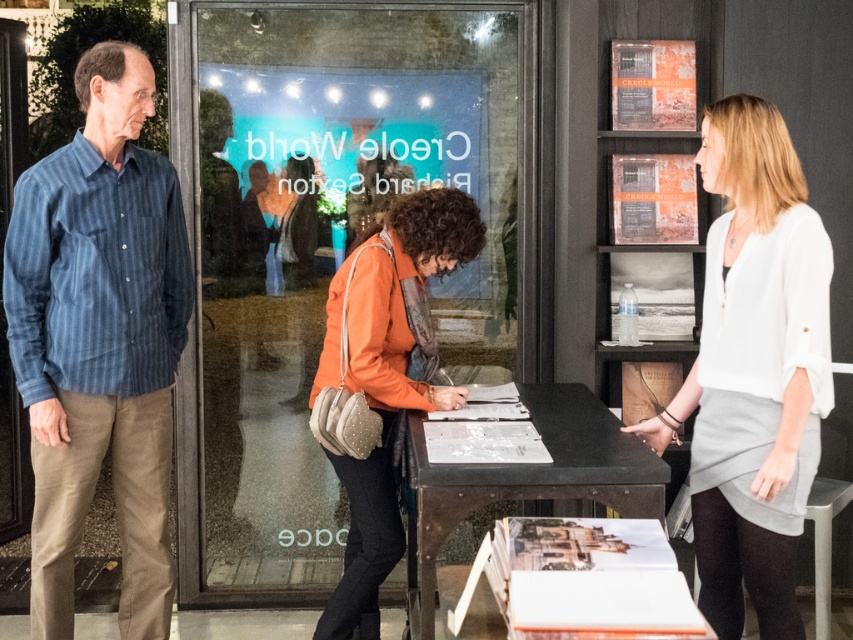
Who is more forward, (64, 528) or (331, 637)?

Point (64, 528) is in front.

Is point (122, 560) farther from viewer compared to point (386, 396)?

Yes, it is.

Locate an element on the screen. The image size is (853, 640). blue striped shirt at left is located at coordinates (99, 339).

Does blue striped shirt at left have a greater height compared to black metal table at center?

Correct, blue striped shirt at left is much taller as black metal table at center.

Identify the location of blue striped shirt at left. The width and height of the screenshot is (853, 640). (99, 339).

Does point (68, 435) come closer to viewer compared to point (579, 460)?

No, it is not.

Image resolution: width=853 pixels, height=640 pixels. Identify the location of blue striped shirt at left. (99, 339).

Is point (502, 316) less distant than point (582, 387)?

No, it is not.

Between transparent glass shop window at center and black metal table at center, which one appears on the left side from the viewer's perspective?

transparent glass shop window at center is more to the left.

Describe the element at coordinates (334, 243) in the screenshot. This screenshot has height=640, width=853. I see `transparent glass shop window at center` at that location.

Locate an element on the screen. transparent glass shop window at center is located at coordinates (334, 243).